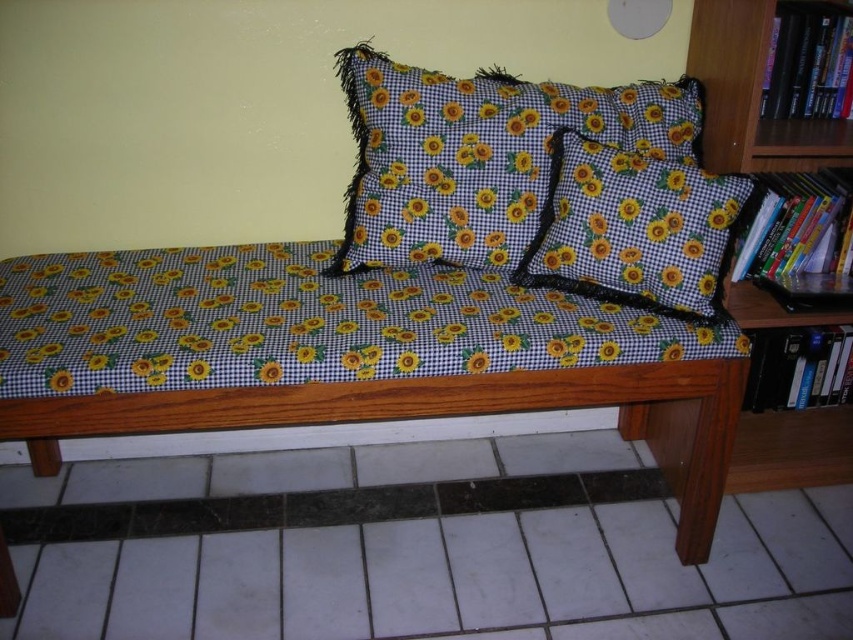
You are organizing a reading corner and want to place a decorative vase between the wooden bookshelf at right and the hardcover book at upper right. Based on their positions, where should you place the vase?

The wooden bookshelf at right is located below the hardcover book at upper right, so the vase should be placed between them vertically. Since the bookshelf is lower and the book is higher, position the vase somewhere in the middle vertically between the two objects.